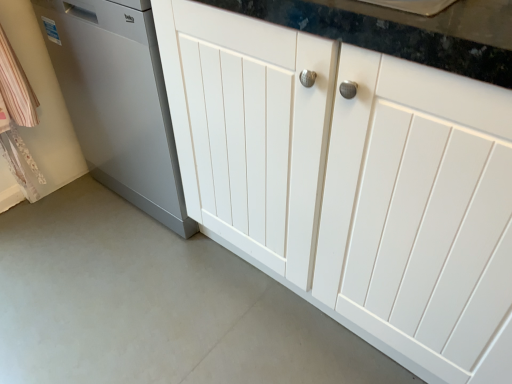
Question: Is white smooth concrete at lower center taller than satin silver dishwasher at left?

Choices:
 (A) yes
 (B) no

Answer: (B)

Question: Could satin silver dishwasher at left be considered to be inside white smooth concrete at lower center?

Choices:
 (A) no
 (B) yes

Answer: (A)

Question: From the image's perspective, is white smooth concrete at lower center over satin silver dishwasher at left?

Choices:
 (A) no
 (B) yes

Answer: (A)

Question: Is white smooth concrete at lower center not inside satin silver dishwasher at left?

Choices:
 (A) yes
 (B) no

Answer: (A)

Question: Is white smooth concrete at lower center positioned far away from satin silver dishwasher at left?

Choices:
 (A) no
 (B) yes

Answer: (A)

Question: Can you confirm if white smooth concrete at lower center is positioned to the right of satin silver dishwasher at left?

Choices:
 (A) no
 (B) yes

Answer: (A)

Question: From the image's perspective, is white smooth concrete at lower center on top of white wood cabinet at center?

Choices:
 (A) no
 (B) yes

Answer: (A)

Question: Is white smooth concrete at lower center next to white wood cabinet at center and touching it?

Choices:
 (A) yes
 (B) no

Answer: (B)

Question: Is white smooth concrete at lower center looking in the opposite direction of white wood cabinet at center?

Choices:
 (A) yes
 (B) no

Answer: (A)

Question: Is white wood cabinet at center located within white smooth concrete at lower center?

Choices:
 (A) no
 (B) yes

Answer: (A)

Question: From a real-world perspective, is white smooth concrete at lower center under white wood cabinet at center?

Choices:
 (A) no
 (B) yes

Answer: (B)

Question: Does white smooth concrete at lower center have a larger size compared to white wood cabinet at center?

Choices:
 (A) no
 (B) yes

Answer: (A)

Question: Does satin silver dishwasher at left have a lesser height compared to white smooth concrete at lower center?

Choices:
 (A) yes
 (B) no

Answer: (B)